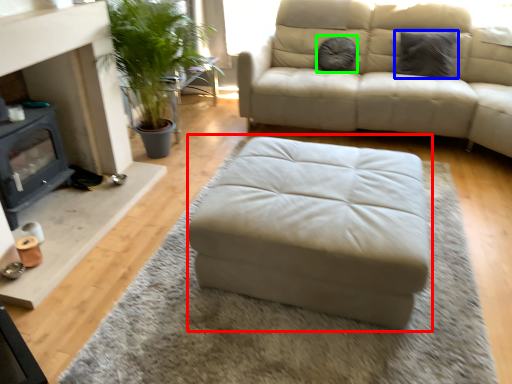
Question: Estimate the real-world distances between objects in this image. Which object is farther from stool (highlighted by a red box), pillow (highlighted by a blue box) or pillow (highlighted by a green box)?

Choices:
 (A) pillow
 (B) pillow

Answer: (A)